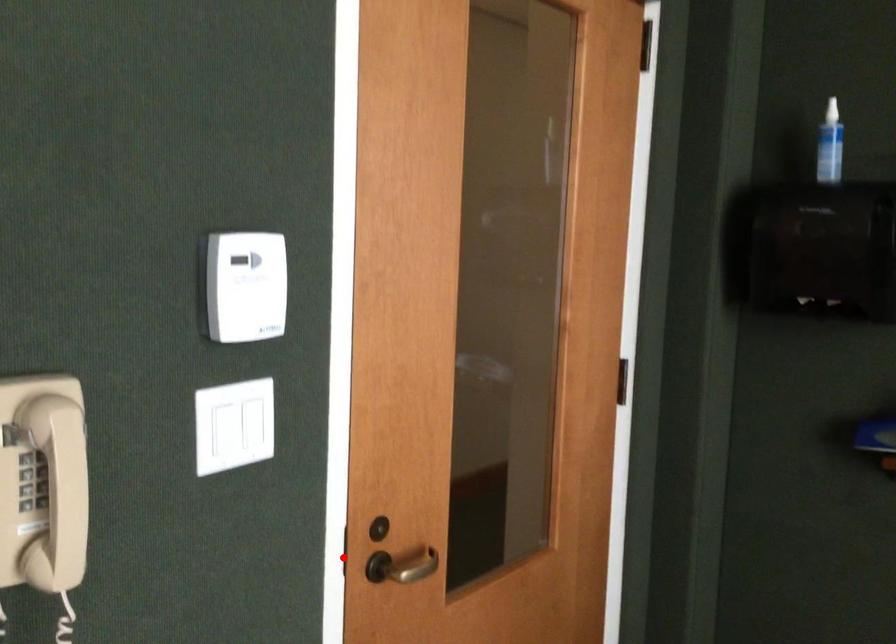
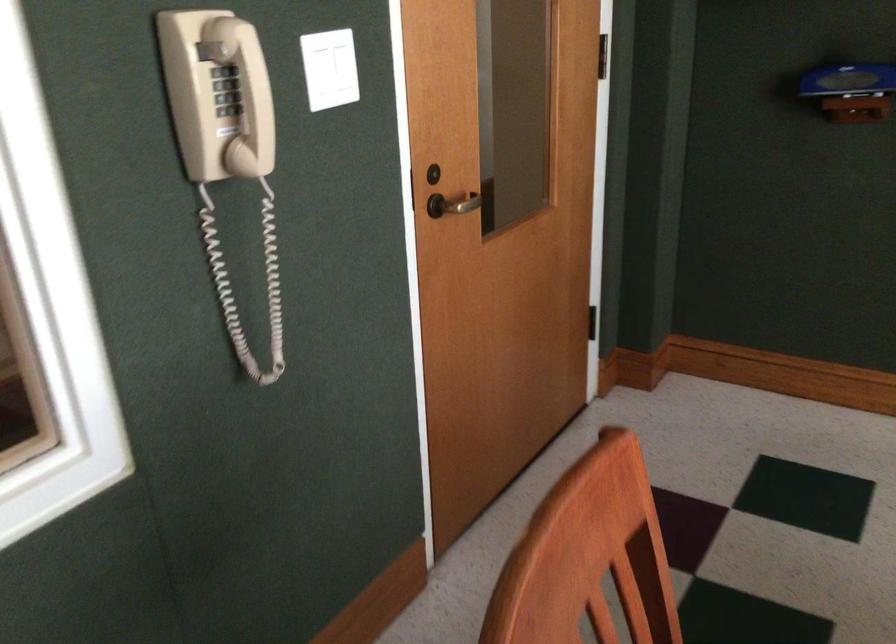
Question: A red point is marked in image1. In image2, is the corresponding 3D point closer to the camera or farther? Reply with the corresponding letter.

Choices:
 (A) The corresponding 3D point is closer.
 (B) The corresponding 3D point is farther.

Answer: (B)